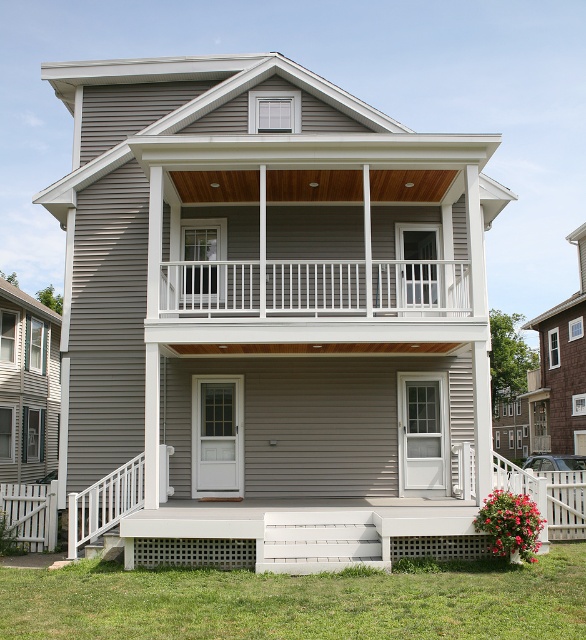
Looking at this image, you are standing on the front porch of the house and want to reach the second floor balcony. You notice the white wooden railing at upper center. Based on its position, can you estimate whether the railing is part of the second floor balcony or the first floor porch?

The white wooden railing at upper center is located at point coordinates of [366,288], which places it on the second floor balcony rather than the first floor porch.

You are standing on the front porch of the house and want to walk towards the white wooden railing at upper center. Which direction should you move relative to the white plastic balustrade at lower left?

You should move to the right relative to the white plastic balustrade at lower left because the white wooden railing at upper center is positioned on the right side of it.